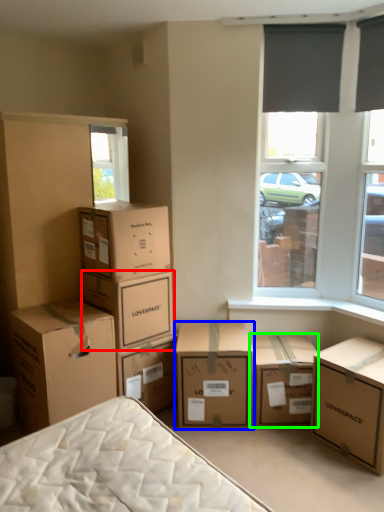
Question: Based on their relative distances, which object is farther from box (highlighted by a red box)? Choose from box (highlighted by a blue box) and box (highlighted by a green box).

Choices:
 (A) box
 (B) box

Answer: (B)